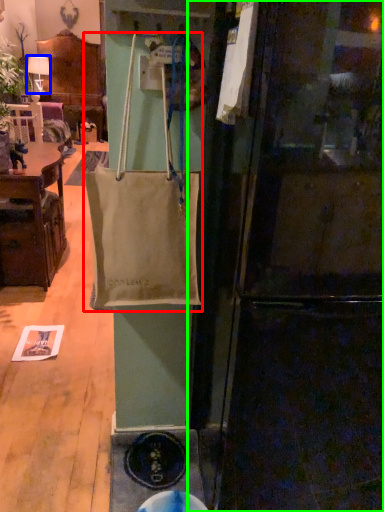
Question: Estimate the real-world distances between objects in this image. Which object is farther from handbag (highlighted by a red box), lamp (highlighted by a blue box) or refrigerator (highlighted by a green box)?

Choices:
 (A) lamp
 (B) refrigerator

Answer: (A)